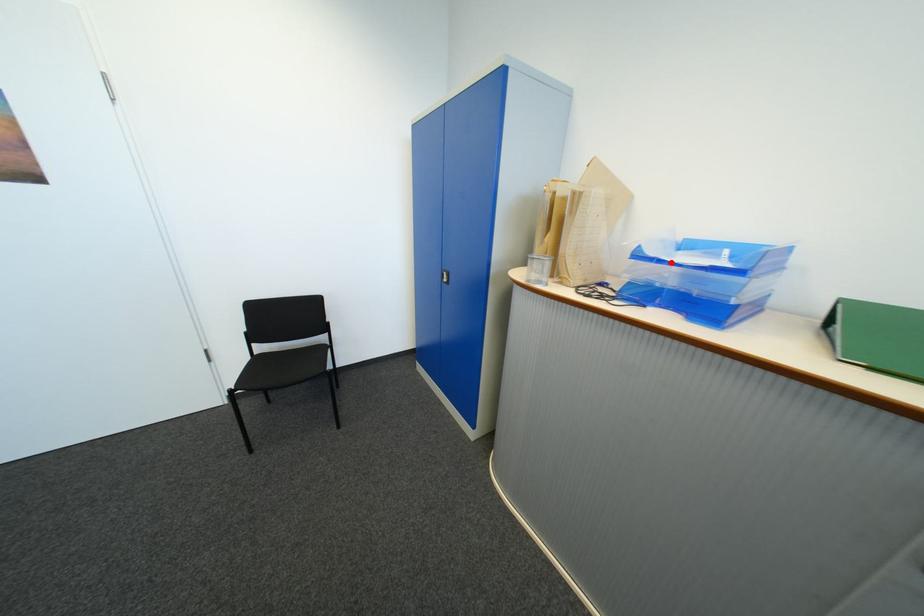
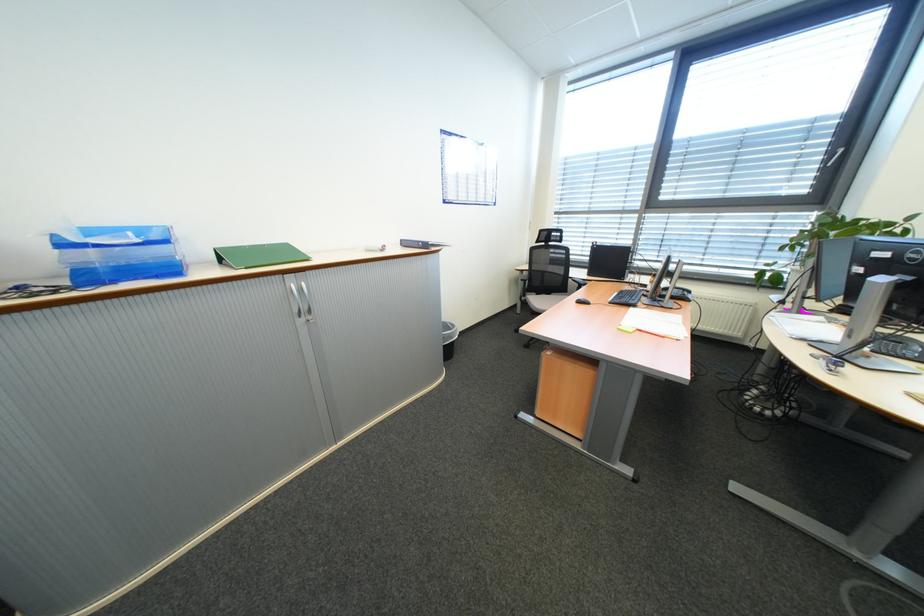
Question: I am providing you with two images of the same scene from different viewpoints. A red point is marked on the first image. Is the red point's position out of view in image 2?

Choices:
 (A) Yes
 (B) No

Answer: (B)